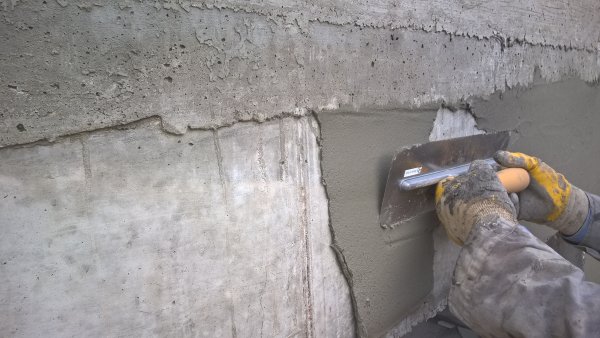
Where is `wall`? The height and width of the screenshot is (338, 600). wall is located at coordinates point(188,218).